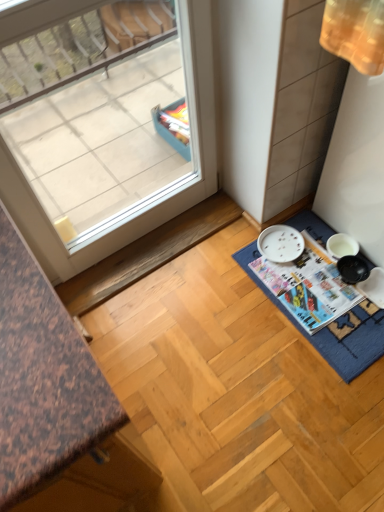
The height and width of the screenshot is (512, 384). Find the location of `vacant area that is in front of blue fabric bath mat at lower right`. vacant area that is in front of blue fabric bath mat at lower right is located at coordinates (304, 424).